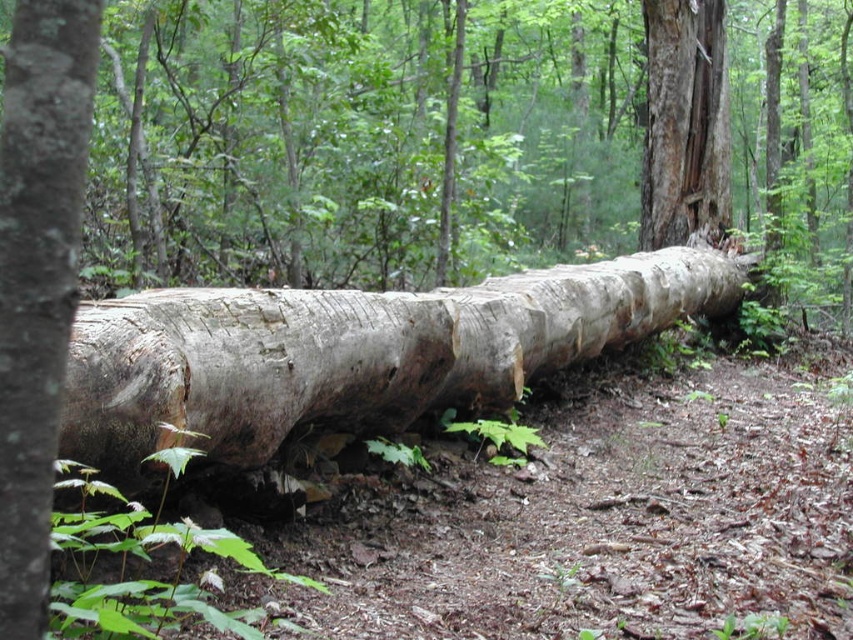
You are a hiker navigating through the forest and need to place a marker at the point closer to you. Which point should you choose between point (x=131, y=432) and point (x=28, y=266)?

You should choose point (x=28, y=266) because it is closer to you than point (x=131, y=432).